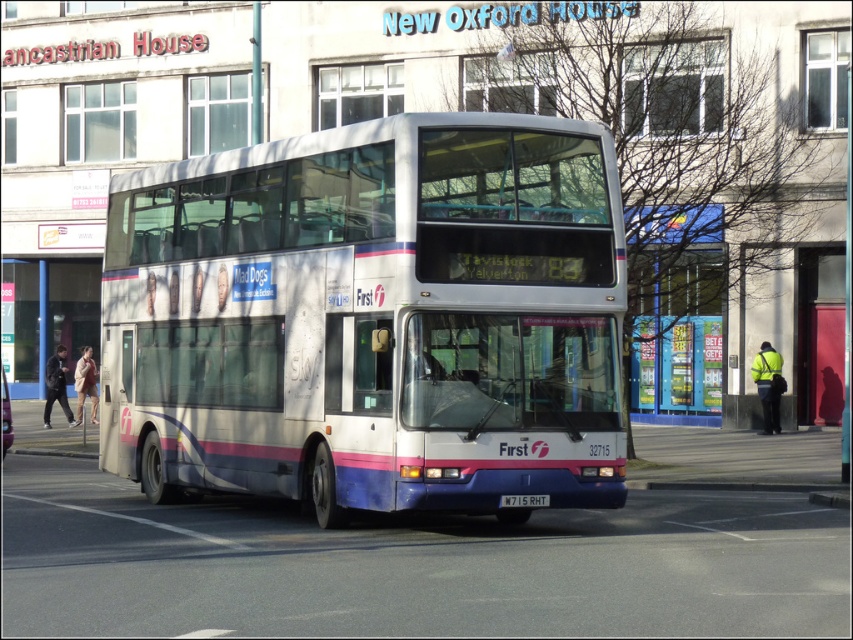
Can you confirm if white metallic bus at center is taller than white plastic license plate at center?

Yes.

Which is more to the right, white metallic bus at center or white plastic license plate at center?

Positioned to the right is white plastic license plate at center.

Is point (531, 172) farther from viewer compared to point (524, 497)?

That is True.

What are the coordinates of `white metallic bus at center` in the screenshot? It's located at (372, 317).